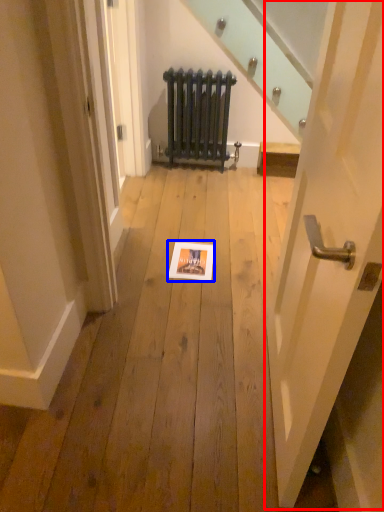
Question: Which object is closer to the camera taking this photo, door (highlighted by a red box) or picture frame (highlighted by a blue box)?

Choices:
 (A) door
 (B) picture frame

Answer: (A)